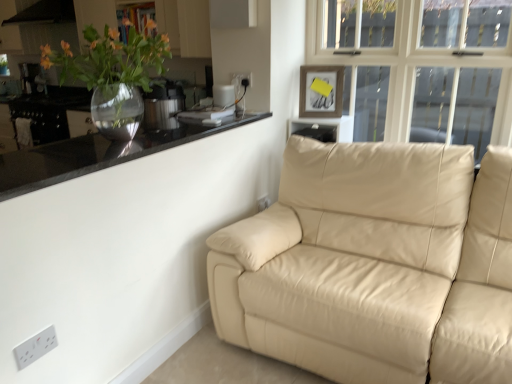
Question: Based on their sizes in the image, would you say white plastic electric outlet at lower center, marked as the 2th electric outlet in a bottom-to-top arrangement, is bigger or smaller than black matte exhaust hood at upper left?

Choices:
 (A) small
 (B) big

Answer: (A)

Question: Is point (257, 208) positioned closer to the camera than point (5, 21)?

Choices:
 (A) farther
 (B) closer

Answer: (B)

Question: Considering the real-world distances, which object is farthest from the white plastic electric outlet at lower left, arranged as the 3th electric outlet when viewed from the right?

Choices:
 (A) beige leather couch at right
 (B) white plastic electric outlet at lower center, the 1th electric outlet in the back-to-front sequence
 (C) white plastic electric outlet at upper center, the second electric outlet viewed from the front
 (D) satin silver pressure cooker at upper left, which is counted as the second appliance, starting from the top
 (E) white matte window sill at upper center

Answer: (E)

Question: Considering the real-world distances, which object is farthest from the white plastic electric outlet at lower left, the 1th electric outlet in the front-to-back sequence?

Choices:
 (A) white matte window sill at upper center
 (B) wooden picture frame at upper center
 (C) black glossy countertop at upper left
 (D) brushed metal kettle at left, positioned as the first appliance in back-to-front order
 (E) white plastic electric outlet at upper center, the second electric outlet viewed from the front

Answer: (D)